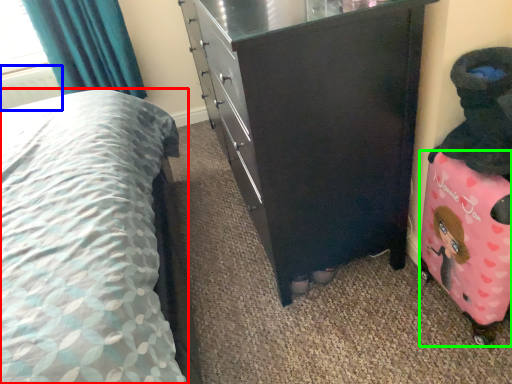
Question: Which object is the farthest from bed (highlighted by a red box)? Choose among these: radiator (highlighted by a blue box) or luggage (highlighted by a green box).

Choices:
 (A) radiator
 (B) luggage

Answer: (A)